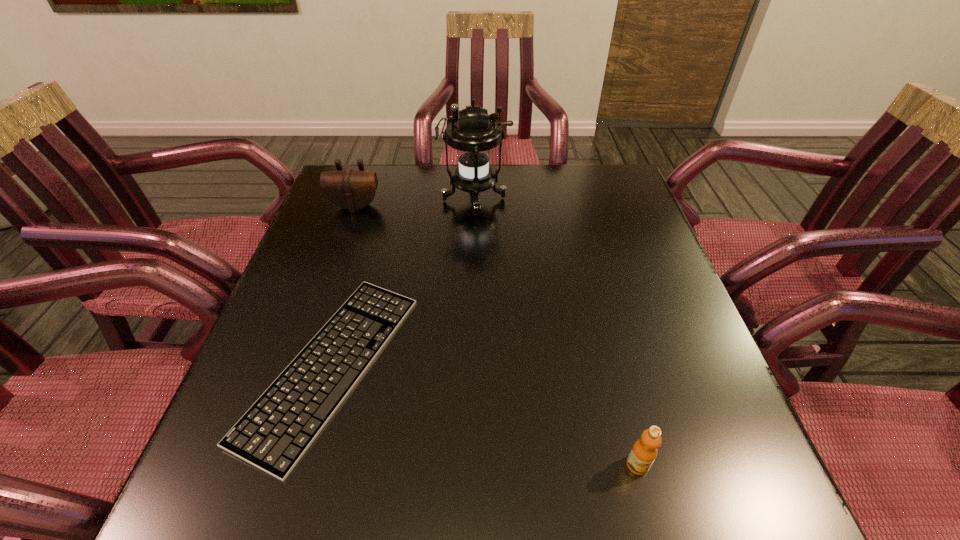
In order to click on lantern in this screenshot , I will do `click(473, 133)`.

The height and width of the screenshot is (540, 960). What are the coordinates of `the third object from left to right` in the screenshot? It's located at (473, 133).

Locate an element on the screen. pouch is located at coordinates (349, 189).

The image size is (960, 540). I want to click on orange juice, so point(644,451).

The width and height of the screenshot is (960, 540). In order to click on the shortest object in this screenshot , I will do `click(273, 435)`.

You are a GUI agent. You are given a task and a screenshot of the screen. Output one action in this format:
    pyautogui.click(x=<x>, y=<y>)
    Task: Click on the vacant region located on the right of the lantern
    
    Given the screenshot: What is the action you would take?
    pyautogui.click(x=629, y=200)

The image size is (960, 540). Identify the location of free space located 0.330m with the flap open on the pouch. (322, 302).

Locate an element on the screen. The image size is (960, 540). free location located on the right of the computer keyboard is located at coordinates (573, 366).

Locate an element on the screen. The image size is (960, 540). lantern at the far edge is located at coordinates (473, 133).

This screenshot has width=960, height=540. Identify the location of pouch that is at the far edge. (349, 189).